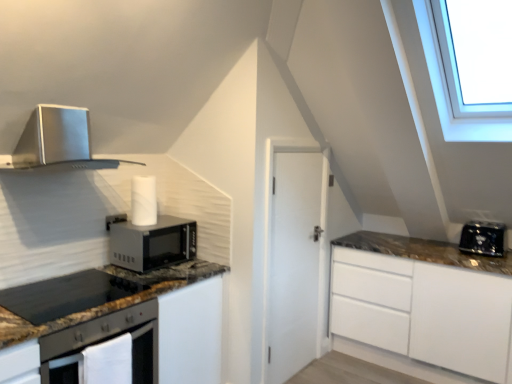
Measure the distance between point (183,353) and camera.

Point (183,353) is 7.75 feet from camera.

Where is `satin silver range hood at upper left`? The image size is (512, 384). satin silver range hood at upper left is located at coordinates (56, 139).

The width and height of the screenshot is (512, 384). I want to click on metallic matte microwave oven at center-left, so click(x=151, y=243).

Find the location of a particular element. This screenshot has width=512, height=384. black plastic toaster at right is located at coordinates (483, 238).

At what (x,y) coordinates should I click in order to perform the action: click on black granite countertop at lower left. Please return your answer as a coordinate pair (x, y). This screenshot has height=384, width=512. Looking at the image, I should click on (120, 326).

Based on the photo, from a real-world perspective, which is physically below, black granite countertop at lower left or black granite gas stove at lower left?

In real-world perspective, black granite countertop at lower left is lower.

Could you measure the distance between black granite countertop at lower left and black granite gas stove at lower left?

black granite countertop at lower left is 6.58 inches from black granite gas stove at lower left.

In order to click on gas stove lying on the left of black granite countertop at lower left in this screenshot , I will do `click(65, 295)`.

Would you consider black granite countertop at lower left to be distant from black granite gas stove at lower left?

black granite countertop at lower left is near black granite gas stove at lower left, not far away.

Considering the sizes of objects black granite gas stove at lower left and black granite countertop at lower left in the image provided, who is smaller, black granite gas stove at lower left or black granite countertop at lower left?

black granite gas stove at lower left is smaller.

Can you tell me how much black granite gas stove at lower left and black granite countertop at lower left differ in facing direction?

They differ by 0.444 degrees in their facing directions.

Looking at this image, does black granite gas stove at lower left appear on the right side of black granite countertop at lower left?

No, black granite gas stove at lower left is not to the right of black granite countertop at lower left.

Considering the sizes of objects black granite gas stove at lower left and black granite countertop at lower left in the image provided, who is taller, black granite gas stove at lower left or black granite countertop at lower left?

Standing taller between the two is black granite countertop at lower left.

Which of these two, black granite gas stove at lower left or metallic matte microwave oven at center-left, stands shorter?

black granite gas stove at lower left is shorter.

Is black granite gas stove at lower left looking in the opposite direction of metallic matte microwave oven at center-left?

No, black granite gas stove at lower left is not facing away from metallic matte microwave oven at center-left.

Does black granite gas stove at lower left have a smaller size compared to metallic matte microwave oven at center-left?

Yes.

The width and height of the screenshot is (512, 384). What are the coordinates of `microwave oven above the black granite gas stove at lower left (from the image's perspective)` in the screenshot? It's located at click(151, 243).

From a real-world perspective, does black granite countertop at lower left stand above black plastic toaster at right?

No.

Is black granite countertop at lower left to the left or to the right of black plastic toaster at right in the image?

Based on their positions, black granite countertop at lower left is located to the left of black plastic toaster at right.

How many degrees apart are the facing directions of black granite countertop at lower left and black plastic toaster at right?

They differ by 90.5 degrees in their facing directions.

Could you tell me if black granite countertop at lower left is facing black plastic toaster at right?

No, black granite countertop at lower left is not aimed at black plastic toaster at right.

Can we say satin silver range hood at upper left lies outside black granite countertop at lower left?

Yes, satin silver range hood at upper left is located beyond the bounds of black granite countertop at lower left.

From the image's perspective, is satin silver range hood at upper left located above or below black granite countertop at lower left?

Based on their image positions, satin silver range hood at upper left is located above black granite countertop at lower left.

Is satin silver range hood at upper left to the left of black granite countertop at lower left from the viewer's perspective?

Correct, you'll find satin silver range hood at upper left to the left of black granite countertop at lower left.

Can you tell me how much satin silver range hood at upper left and black granite gas stove at lower left differ in facing direction?

0.522 degrees separate the facing orientations of satin silver range hood at upper left and black granite gas stove at lower left.

Does satin silver range hood at upper left have a smaller size compared to black granite gas stove at lower left?

No, satin silver range hood at upper left is not smaller than black granite gas stove at lower left.

Is satin silver range hood at upper left facing away from black granite gas stove at lower left?

No, satin silver range hood at upper left is not facing the opposite direction of black granite gas stove at lower left.

Is satin silver range hood at upper left touching black granite gas stove at lower left?

No, satin silver range hood at upper left is not making contact with black granite gas stove at lower left.

Considering the positions of points (195, 253) and (77, 290), is point (195, 253) farther from camera compared to point (77, 290)?

Yes, point (195, 253) is farther from viewer.

Does metallic matte microwave oven at center-left have a larger size compared to black granite gas stove at lower left?

Indeed, metallic matte microwave oven at center-left has a larger size compared to black granite gas stove at lower left.

The image size is (512, 384). There is a black granite gas stove at lower left. What are the coordinates of `microwave oven above it (from a real-world perspective)` in the screenshot? It's located at (151, 243).

This screenshot has height=384, width=512. I want to click on gas stove on the left side of black granite countertop at lower left, so click(65, 295).

You are a GUI agent. You are given a task and a screenshot of the screen. Output one action in this format:
    pyautogui.click(x=<x>, y=<y>)
    Task: Click on the gas stove lying behind the black granite countertop at lower left
    
    Given the screenshot: What is the action you would take?
    pyautogui.click(x=65, y=295)

When comparing their distances from black granite gas stove at lower left, does satin silver range hood at upper left or black plastic toaster at right seem closer?

satin silver range hood at upper left is positioned closer to the anchor black granite gas stove at lower left.

Looking at the image, which one is located closer to black plastic toaster at right, black granite gas stove at lower left or metallic matte microwave oven at center-left?

Among the two, metallic matte microwave oven at center-left is located nearer to black plastic toaster at right.

Consider the image. Based on their spatial positions, is black granite countertop at lower left or black plastic toaster at right further from black granite gas stove at lower left?

Among the two, black plastic toaster at right is located further to black granite gas stove at lower left.

Based on their spatial positions, is satin silver range hood at upper left or metallic matte microwave oven at center-left further from black granite gas stove at lower left?

satin silver range hood at upper left.

Estimate the real-world distances between objects in this image. Which object is closer to metallic matte microwave oven at center-left, black granite gas stove at lower left or black plastic toaster at right?

The object closer to metallic matte microwave oven at center-left is black granite gas stove at lower left.

Looking at the image, which one is located further to black plastic toaster at right, satin silver range hood at upper left or metallic matte microwave oven at center-left?

Based on the image, satin silver range hood at upper left appears to be further to black plastic toaster at right.

Estimate the real-world distances between objects in this image. Which object is further from black plastic toaster at right, metallic matte microwave oven at center-left or satin silver range hood at upper left?

satin silver range hood at upper left.

When comparing their distances from satin silver range hood at upper left, does black plastic toaster at right or black granite gas stove at lower left seem further?

black plastic toaster at right lies further to satin silver range hood at upper left than the other object.

At what (x,y) coordinates should I click in order to perform the action: click on cabinetry between black granite gas stove at lower left and black plastic toaster at right. Please return your answer as a coordinate pair (x, y). Looking at the image, I should click on (120, 326).

Find the location of `microwave oven between satin silver range hood at upper left and black granite countertop at lower left vertically`. microwave oven between satin silver range hood at upper left and black granite countertop at lower left vertically is located at coordinates [x=151, y=243].

Where is `gas stove between satin silver range hood at upper left and black granite countertop at lower left in the vertical direction`? This screenshot has width=512, height=384. gas stove between satin silver range hood at upper left and black granite countertop at lower left in the vertical direction is located at coordinates (65, 295).

Locate an element on the screen. This screenshot has height=384, width=512. cabinetry located between satin silver range hood at upper left and black plastic toaster at right in the left-right direction is located at coordinates (120, 326).